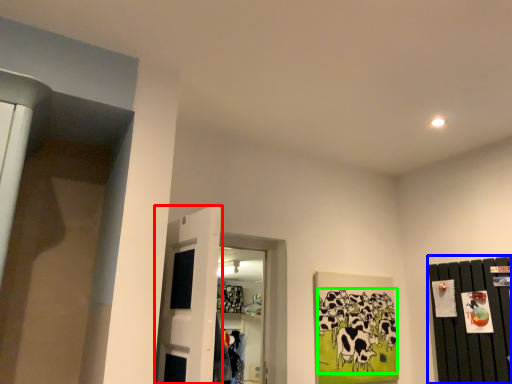
Question: Based on their relative distances, which object is farther from door (highlighted by a red box)? Choose from dresser (highlighted by a blue box) and animal (highlighted by a green box).

Choices:
 (A) dresser
 (B) animal

Answer: (A)